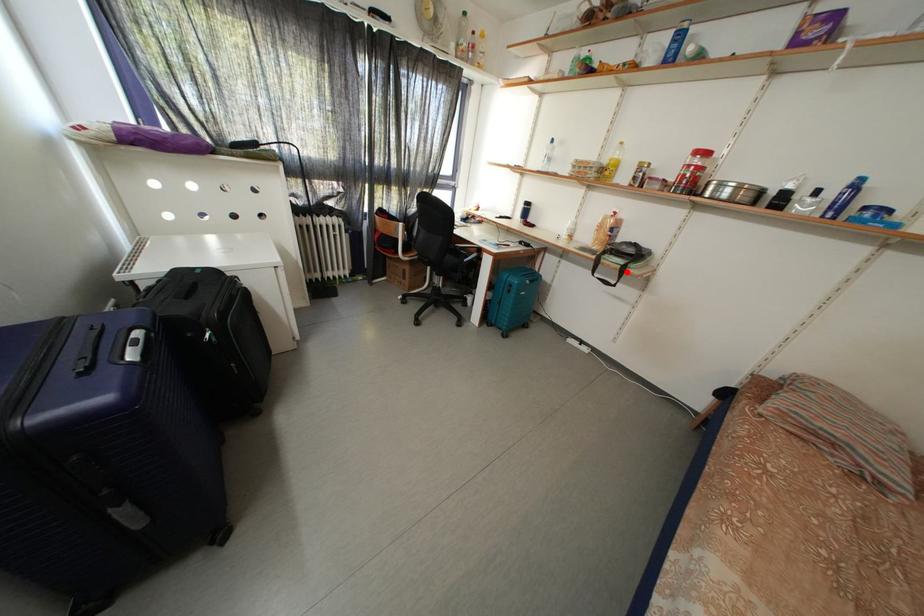
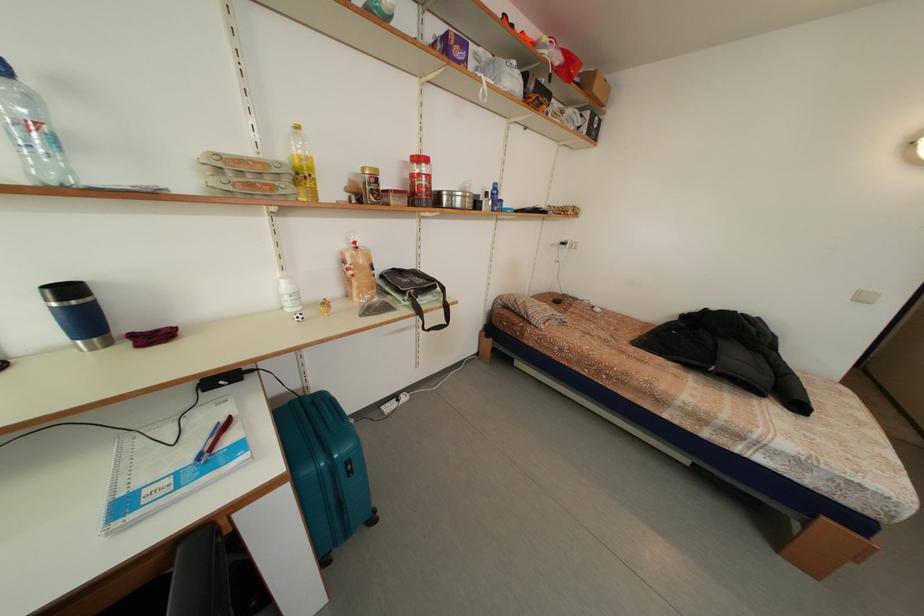
In the second image, find the point that corresponds to the highlighted location in the first image.

(448, 310)